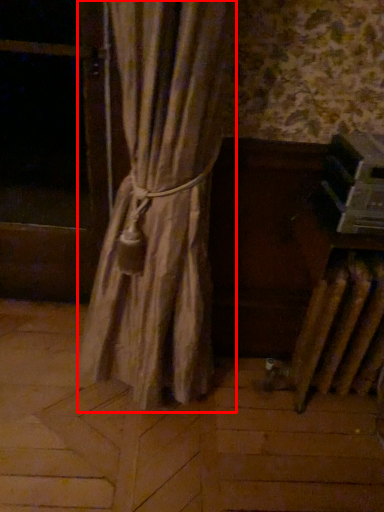
Question: From the image's perspective, considering the relative positions of curtain (annotated by the red box) and window screen in the image provided, where is curtain (annotated by the red box) located with respect to the staircase?

Choices:
 (A) above
 (B) below

Answer: (B)